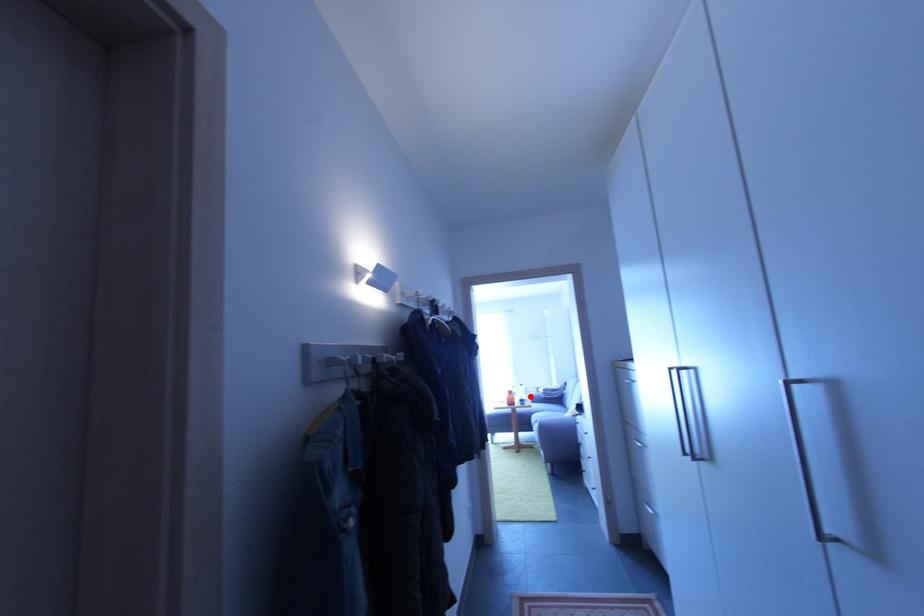
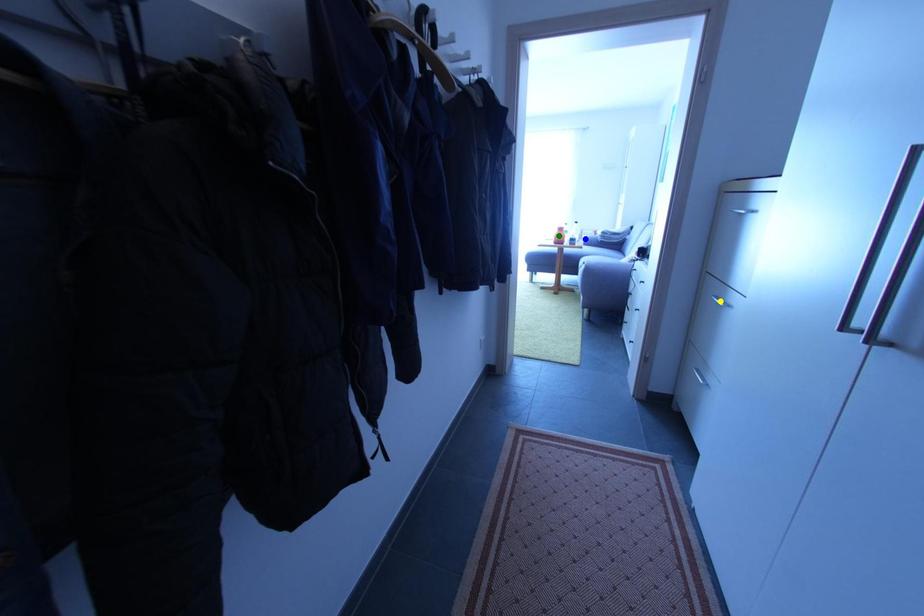
Question: I am providing you with two images of the same scene from different viewpoints. A red point is marked on the first image. You are given multiple points on the second image. Which spot in image 2 lines up with the point in image 1?

Choices:
 (A) green point
 (B) blue point
 (C) yellow point

Answer: (B)